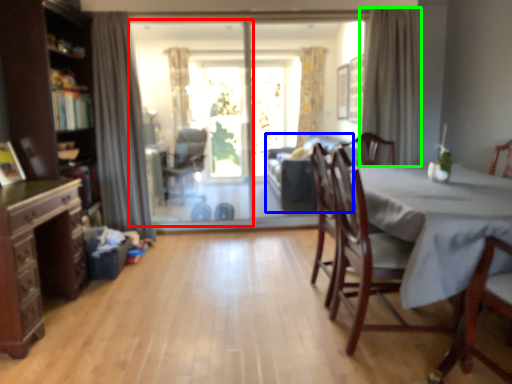
Question: Which is farther away from screen door (highlighted by a red box)? couch (highlighted by a blue box) or curtain (highlighted by a green box)?

Choices:
 (A) couch
 (B) curtain

Answer: (B)